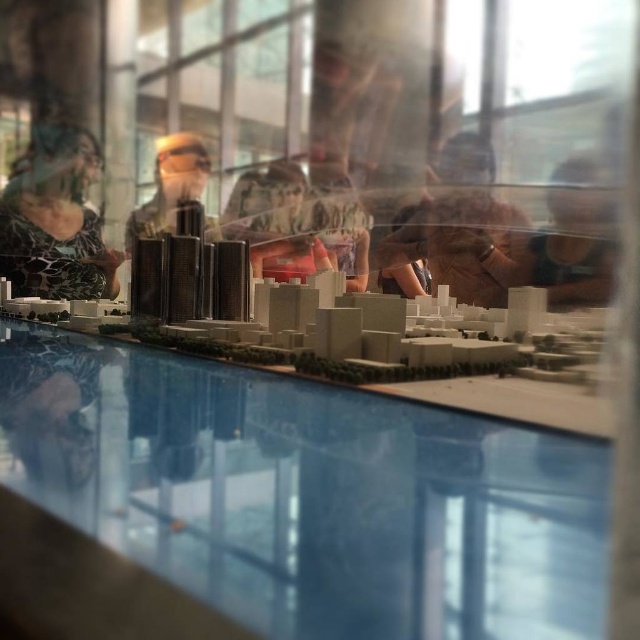
You are standing in front of the model cityscape and want to place a small figurine on the transparent glass table at center. Based on the model layout, can you determine if the table has enough space to accommodate the figurine without it overlapping with any buildings?

The transparent glass table at center is located at point (307, 493), which is within the exhibition space. Since the model cityscape is displayed behind the reflective glass and the table is in the foreground, there is sufficient space on the table to place the figurine without overlapping with the buildings behind it.